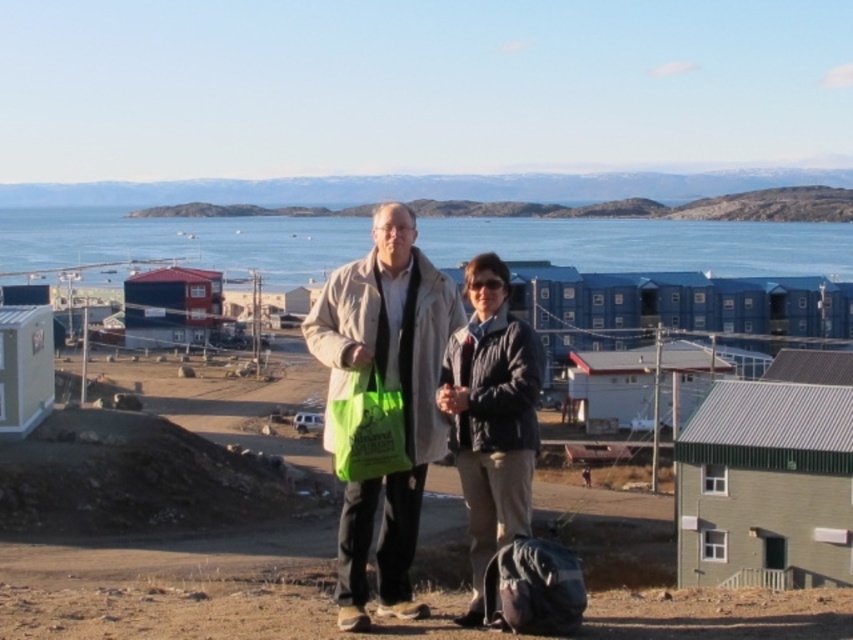
Can you confirm if blue water at center is bigger than beige fabric coat at center?

Indeed, blue water at center has a larger size compared to beige fabric coat at center.

Is point (837, 266) less distant than point (397, 276)?

No, it is behind (397, 276).

I want to click on blue water at center, so click(647, 244).

Who is lower down, dark blue quilted jacket at center or green fabric shopping bag at lower right?

Positioned lower is dark blue quilted jacket at center.

Is dark blue quilted jacket at center bigger than green fabric shopping bag at lower right?

Yes.

Who is more forward, [491,324] or [521,550]?

Point [521,550]

Identify the location of dark blue quilted jacket at center. (491, 417).

Consider the image. Does beige fabric coat at center appear on the right side of dark blue quilted jacket at center?

In fact, beige fabric coat at center is to the left of dark blue quilted jacket at center.

Can you confirm if beige fabric coat at center is bigger than dark blue quilted jacket at center?

Yes.

Where is `beige fabric coat at center`? beige fabric coat at center is located at coordinates (x=387, y=388).

You are a GUI agent. You are given a task and a screenshot of the screen. Output one action in this format:
    pyautogui.click(x=<x>, y=<y>)
    Task: Click on the beige fabric coat at center
    The height and width of the screenshot is (640, 853).
    Given the screenshot: What is the action you would take?
    pyautogui.click(x=387, y=388)